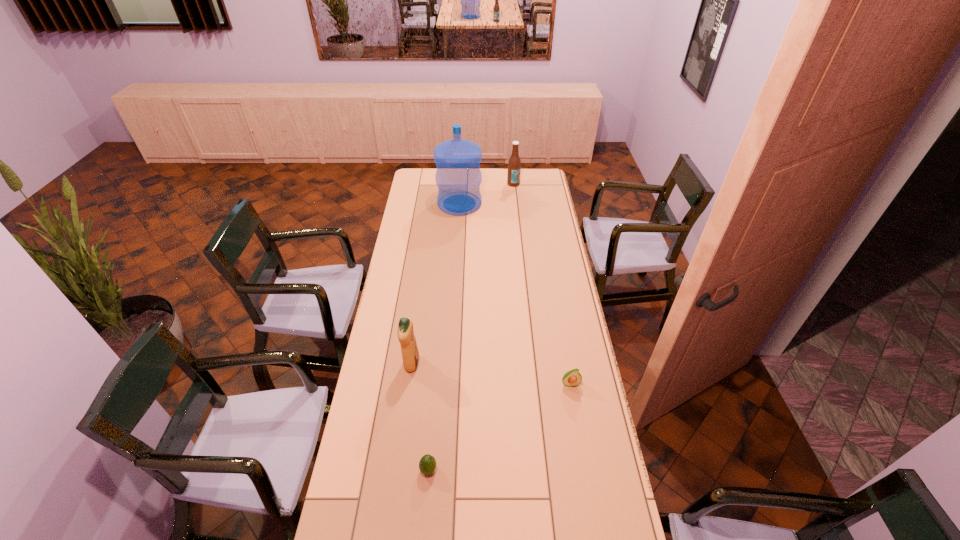
This screenshot has height=540, width=960. In order to click on vacant space located on the left of the beer bottle in this screenshot , I will do `click(470, 184)`.

Find the location of a particular element. free space located 0.260m on the label of the detergent is located at coordinates (487, 364).

This screenshot has width=960, height=540. I want to click on vacant space located 0.150m on the cut side of the rightmost object, so click(578, 427).

At what (x,y) coordinates should I click in order to perform the action: click on vacant space located on the back of the left avocado. Please return your answer as a coordinate pair (x, y). The height and width of the screenshot is (540, 960). Looking at the image, I should click on (433, 418).

Locate an element on the screen. Image resolution: width=960 pixels, height=540 pixels. object at the far edge is located at coordinates (514, 164).

Identify the location of object positioned at the left edge. The height and width of the screenshot is (540, 960). (410, 355).

You are a GUI agent. You are given a task and a screenshot of the screen. Output one action in this format:
    pyautogui.click(x=<x>, y=<y>)
    Task: Click on the object present at the right edge
    This screenshot has height=540, width=960.
    Given the screenshot: What is the action you would take?
    pyautogui.click(x=572, y=378)

In the image, there is a desktop. Identify the location of free space at the far edge. The height and width of the screenshot is (540, 960). (507, 168).

At what (x,y) coordinates should I click in order to perform the action: click on free point at the left edge. Please return your answer as a coordinate pair (x, y). This screenshot has height=540, width=960. Looking at the image, I should click on (362, 426).

Image resolution: width=960 pixels, height=540 pixels. I want to click on free spot at the right edge of the desktop, so click(x=585, y=367).